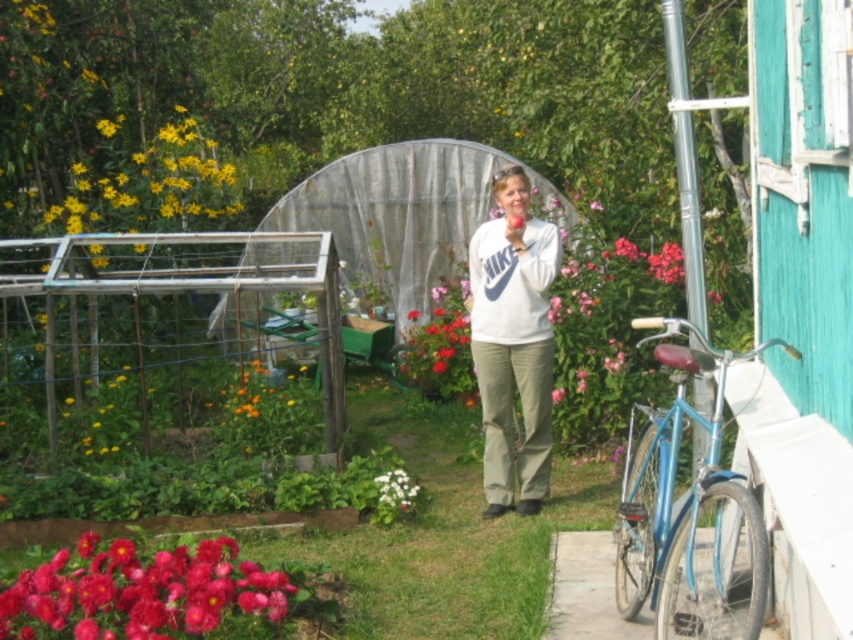
Question: Which point is farther from the camera taking this photo?

Choices:
 (A) (389, 497)
 (B) (691, 374)
 (C) (619, 284)
 (D) (498, 230)

Answer: (C)

Question: Which is nearer to the white fluffy flower at lower center?

Choices:
 (A) matte white flower at center
 (B) white matte sweatshirt at center

Answer: (B)

Question: Where is white matte sweatshirt at center located in relation to matte white flower at center in the image?

Choices:
 (A) right
 (B) left

Answer: (B)

Question: Does blue metallic bicycle at right have a larger size compared to white fluffy flower at lower center?

Choices:
 (A) no
 (B) yes

Answer: (B)

Question: Which point appears closest to the camera in this image?

Choices:
 (A) pos(196,576)
 (B) pos(497,419)

Answer: (A)

Question: Does blue metallic bicycle at right appear on the right side of vibrant red petals at center?

Choices:
 (A) no
 (B) yes

Answer: (B)